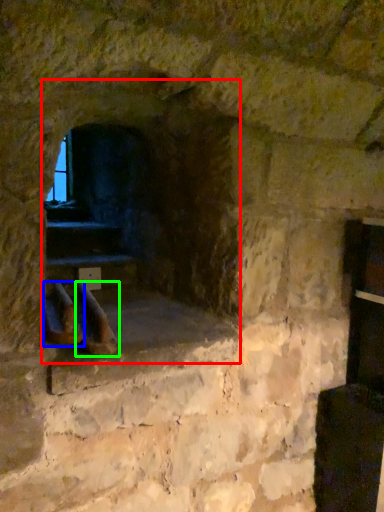
Question: Which is farther away from fireplace (highlighted by a red box)? footwear (highlighted by a blue box) or footwear (highlighted by a green box)?

Choices:
 (A) footwear
 (B) footwear

Answer: (A)